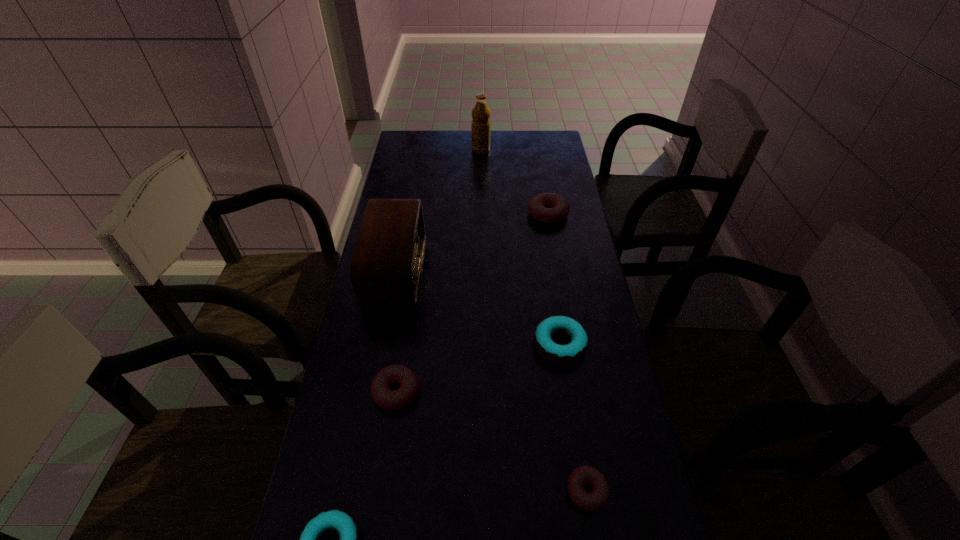
Locate an element on the screen. The height and width of the screenshot is (540, 960). object that is at the far edge is located at coordinates (480, 127).

Identify the location of radio receiver present at the left edge. (385, 269).

Find the location of a particular element. This screenshot has height=540, width=960. doughnut that is at the left edge is located at coordinates (385, 398).

The image size is (960, 540). Identify the location of free location at the left edge of the desktop. (339, 381).

Where is `free location at the right edge`? free location at the right edge is located at coordinates (563, 281).

This screenshot has width=960, height=540. I want to click on free location at the far left corner of the desktop, so click(428, 141).

The height and width of the screenshot is (540, 960). In the image, there is a desktop. In order to click on vacant space at the far right corner in this screenshot , I will do `click(547, 138)`.

In order to click on vacant area that lies between the farthest doughnut and the tallest object in this screenshot , I will do `click(515, 182)`.

What are the coordinates of `vacant area that lies between the farthest object and the sixth shortest object` in the screenshot? It's located at (439, 211).

Select which object appears as the fifth closest to the farthest pink doughnut. Please provide its 2D coordinates. Your answer should be formatted as a tuple, i.e. [(x, y)], where the tuple contains the x and y coordinates of a point satisfying the conditions above.

[(582, 475)]